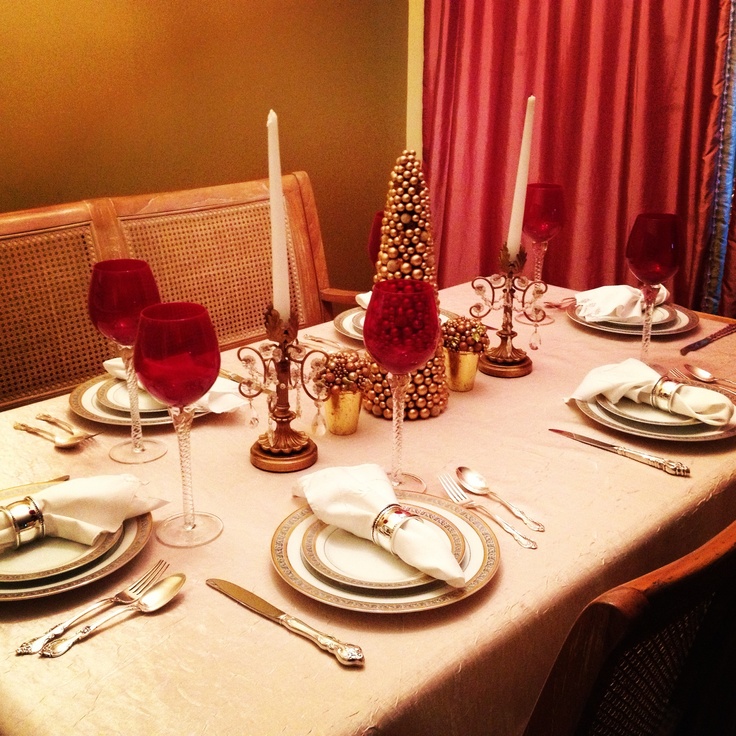
Image resolution: width=736 pixels, height=736 pixels. I want to click on small plates, so click(x=57, y=565), click(x=353, y=558), click(x=639, y=414), click(x=637, y=322), click(x=358, y=318), click(x=113, y=389).